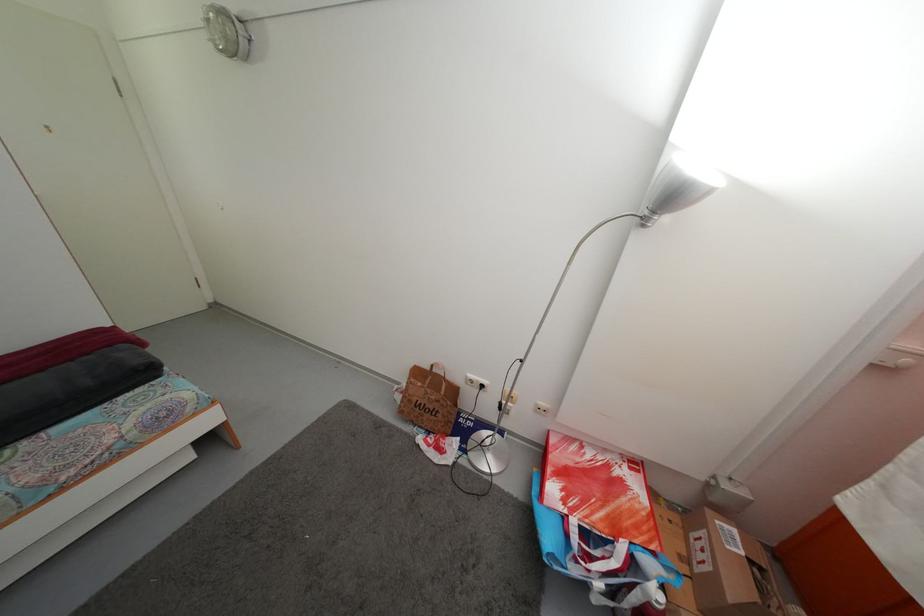
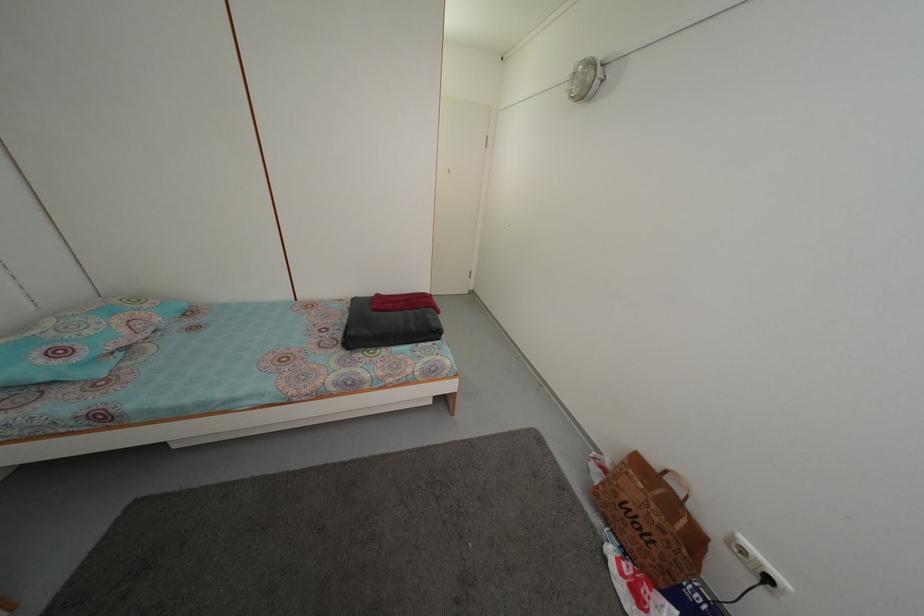
The point at [433,375] is marked in the first image. Where is the corresponding point in the second image?

(662, 475)